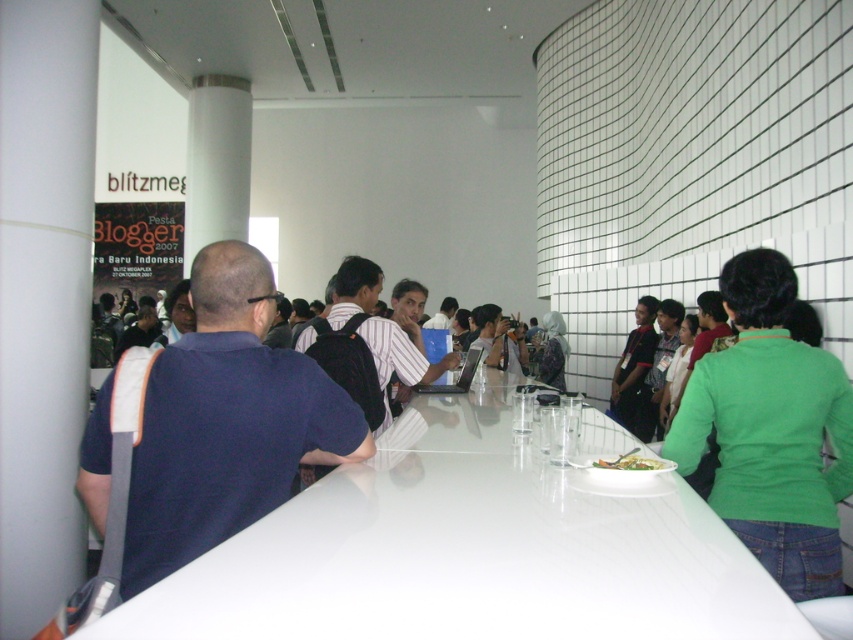
In the scene shown: Who is more forward, (724, 433) or (598, 465)?

Positioned in front is point (598, 465).

Identify the location of green matte shirt at center. (770, 429).

Locate an element on the screen. green matte shirt at center is located at coordinates (770, 429).

What are the coordinates of `white glossy table at center` in the screenshot? It's located at (469, 550).

Is point (775, 632) less distant than point (149, 552)?

Yes, point (775, 632) is in front of point (149, 552).

This screenshot has width=853, height=640. I want to click on white glossy table at center, so click(469, 550).

You are a GUI agent. You are given a task and a screenshot of the screen. Output one action in this format:
    pyautogui.click(x=<x>, y=<y>)
    Task: Click on the white glossy table at center
    
    Given the screenshot: What is the action you would take?
    pyautogui.click(x=469, y=550)

Is the position of white glossy table at center less distant than that of green leafy salad at center?

Yes, white glossy table at center is in front of green leafy salad at center.

Is white glossy table at center shorter than green leafy salad at center?

In fact, white glossy table at center may be taller than green leafy salad at center.

Locate an element on the screen. This screenshot has width=853, height=640. white glossy table at center is located at coordinates (469, 550).

This screenshot has height=640, width=853. In order to click on white glossy table at center in this screenshot , I will do `click(469, 550)`.